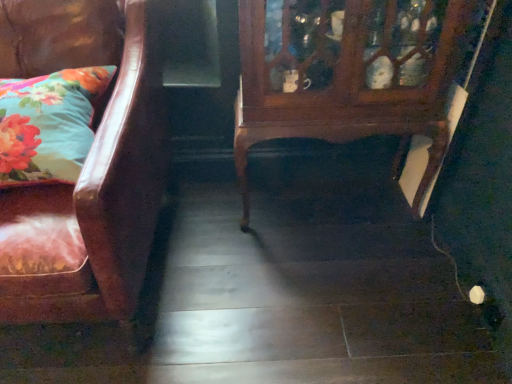
The width and height of the screenshot is (512, 384). In order to click on free region on the left part of wooden cabinet at center in this screenshot , I will do `click(220, 232)`.